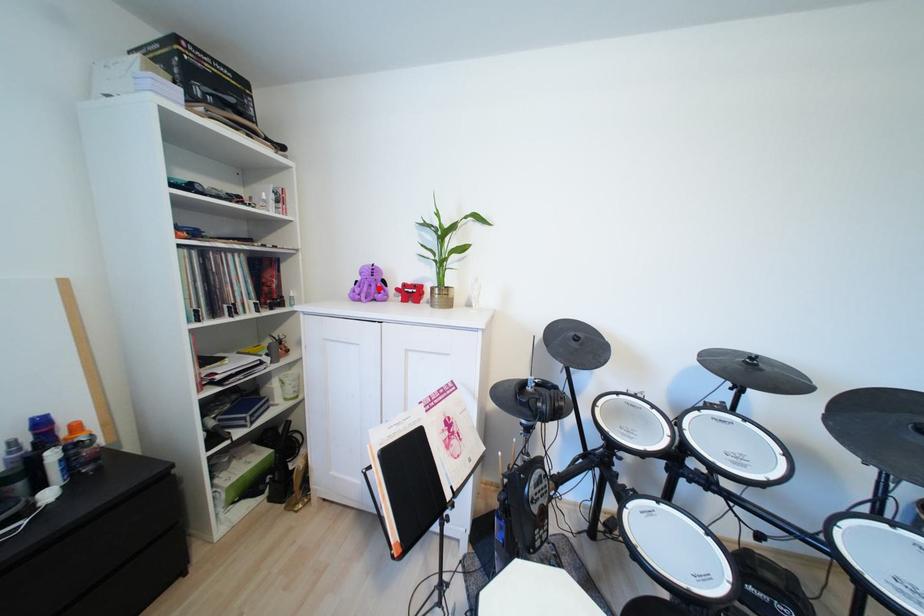
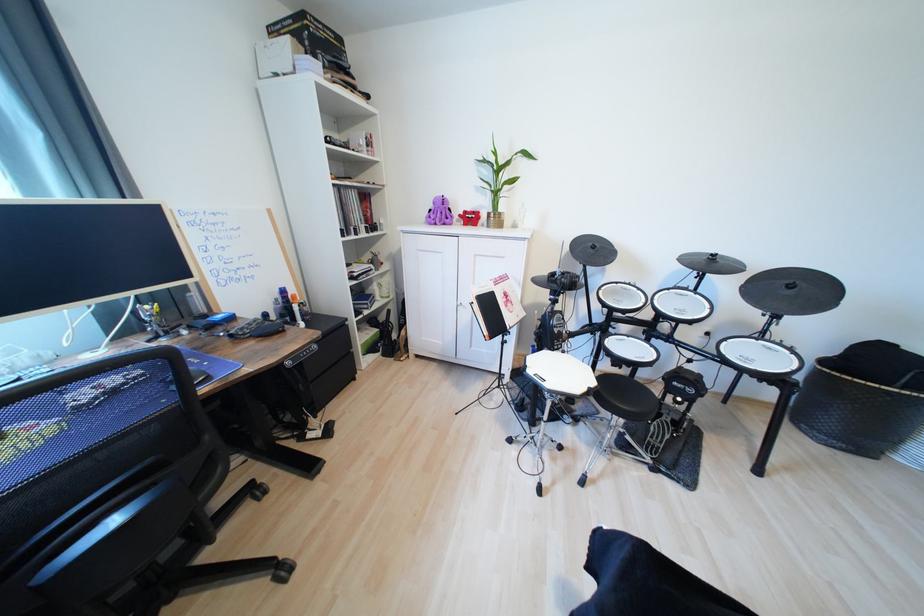
In the second image, find the point that corresponds to the highlighted location in the first image.

(447, 216)